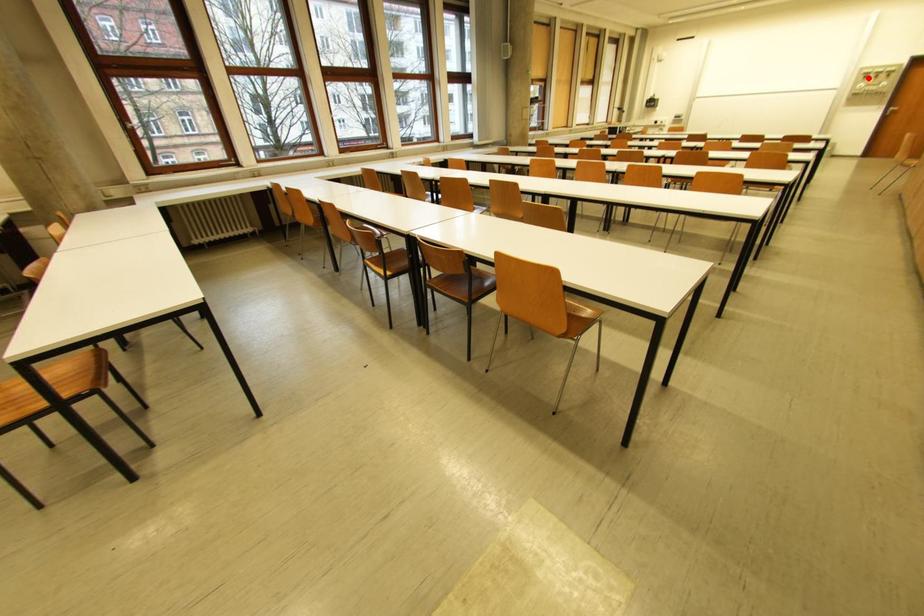
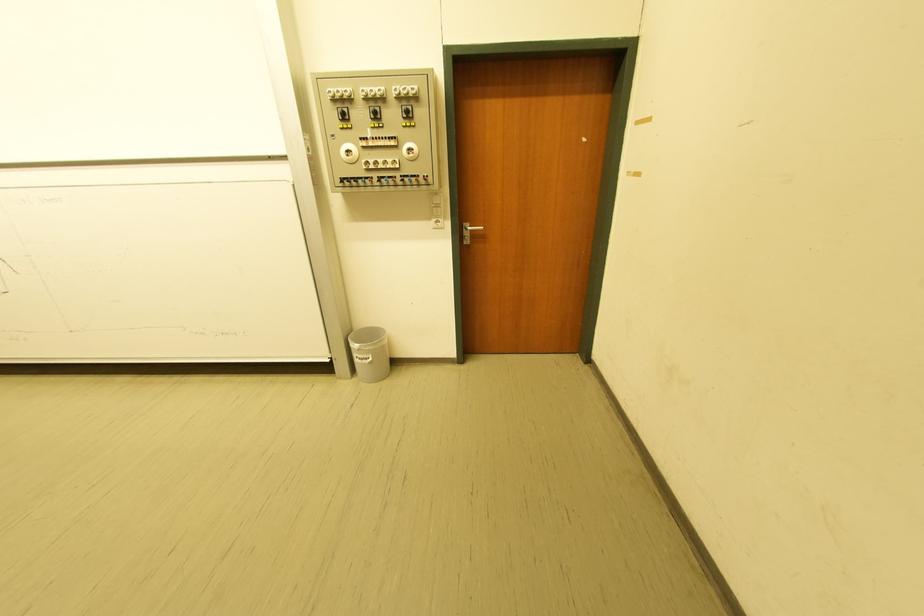
Find the pixel in the second image that matches the highlighted location in the first image.

(342, 116)